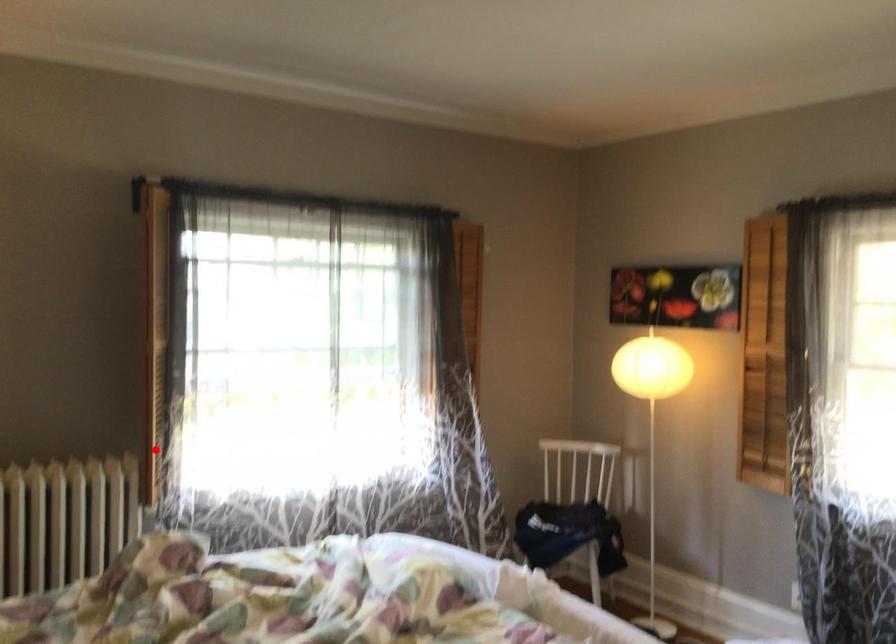
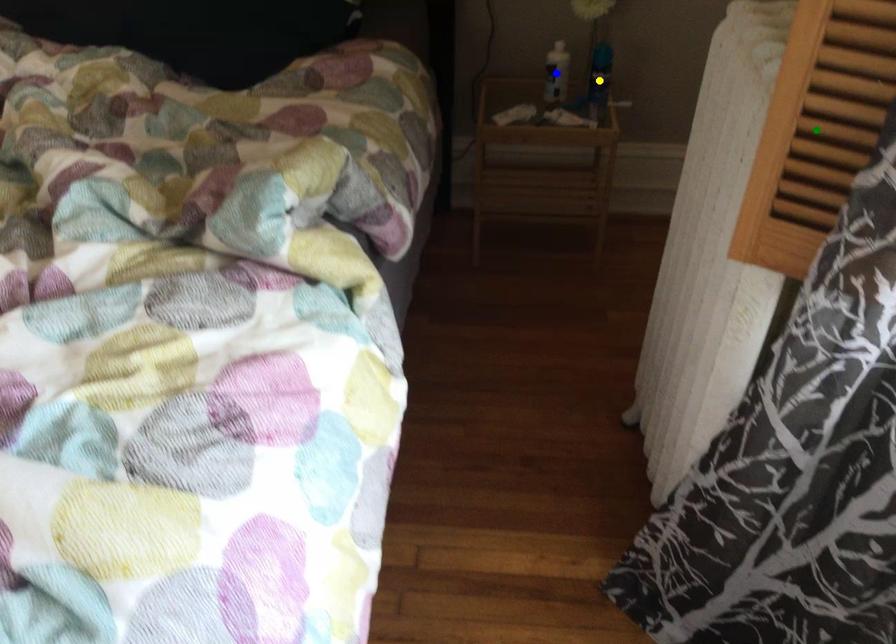
Question: I am providing you with two images of the same scene from different viewpoints. A red point is marked on the first image. You are given multiple points on the second image. Which point in image 2 is actually the same real-world point as the red point in image 1?

Choices:
 (A) blue point
 (B) yellow point
 (C) green point

Answer: (C)